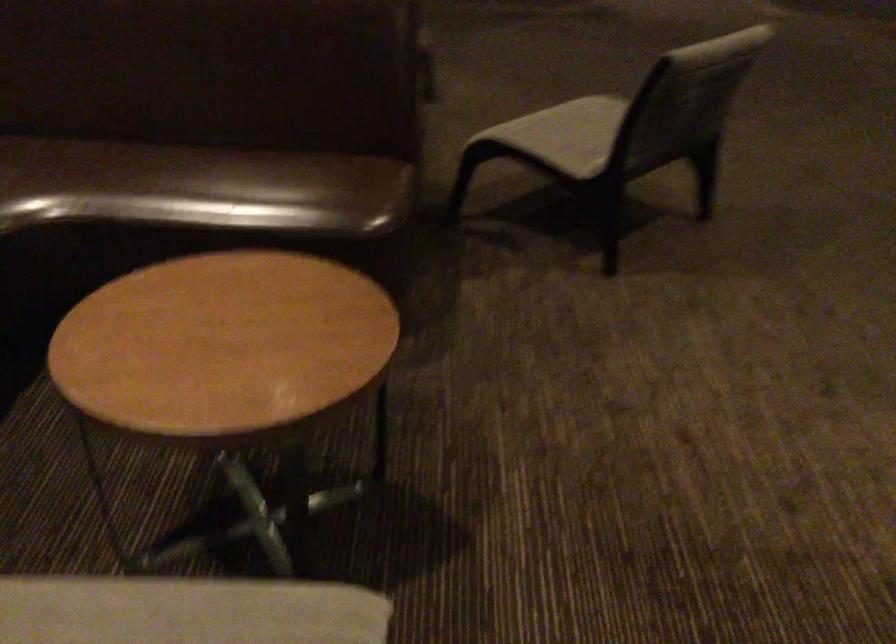
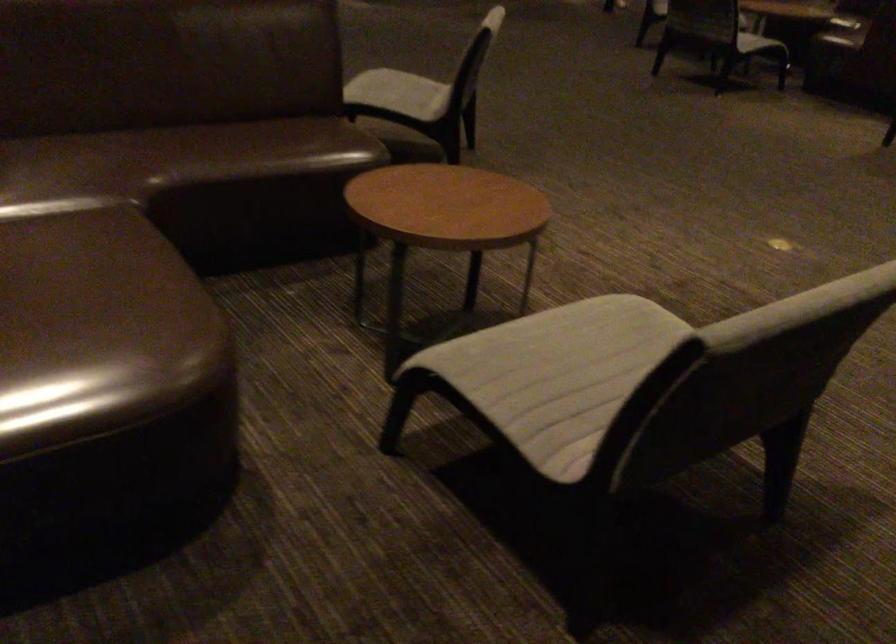
Locate, in the second image, the point that corresponds to pixel 562 136 in the first image.

(399, 93)